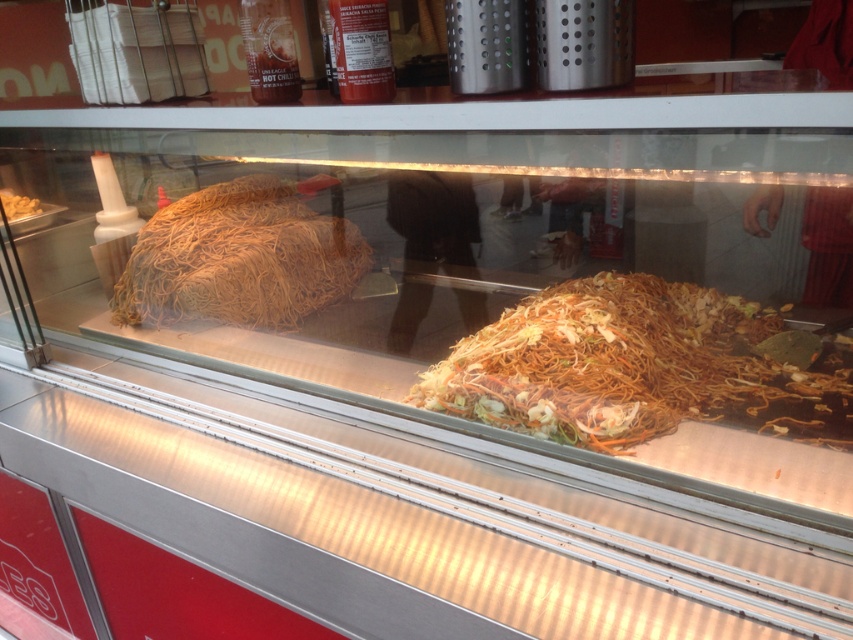
Question: Which is farther from the brown matte noodles at left?

Choices:
 (A) white matte bread at upper left
 (B) shiny brown noodles at center

Answer: (A)

Question: Can you confirm if shiny brown noodles at center is bigger than white matte bread at upper left?

Choices:
 (A) no
 (B) yes

Answer: (B)

Question: Which object is closer to the camera taking this photo?

Choices:
 (A) shiny brown noodles at center
 (B) brown matte noodles at left
 (C) white matte bread at upper left

Answer: (A)

Question: Based on their relative distances, which object is farther from the shiny brown noodles at center?

Choices:
 (A) white matte bread at upper left
 (B) brown matte noodles at left

Answer: (A)

Question: Where is shiny brown noodles at center located in relation to white matte bread at upper left in the image?

Choices:
 (A) above
 (B) below

Answer: (B)

Question: Is brown matte noodles at left bigger than white matte bread at upper left?

Choices:
 (A) no
 (B) yes

Answer: (B)